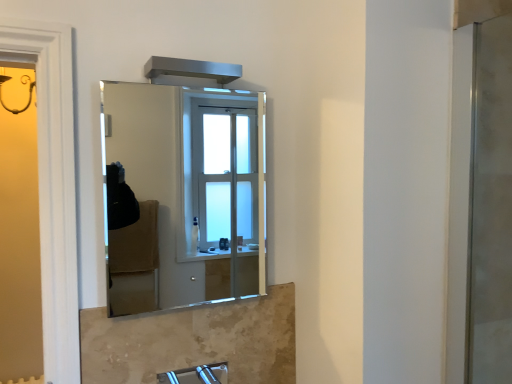
Question: In terms of width, does clear glass mirror at center look wider or thinner when compared to clear glass screen door at right?

Choices:
 (A) wide
 (B) thin

Answer: (B)

Question: Considering the positions of clear glass mirror at center and clear glass screen door at right in the image, is clear glass mirror at center taller or shorter than clear glass screen door at right?

Choices:
 (A) tall
 (B) short

Answer: (B)

Question: Considering the real-world distances, which object is farthest from the satin nickel faucet at lower center?

Choices:
 (A) clear glass mirror at center
 (B) clear glass screen door at right

Answer: (A)

Question: Estimate the real-world distances between objects in this image. Which object is farther from the clear glass mirror at center?

Choices:
 (A) satin nickel faucet at lower center
 (B) clear glass screen door at right

Answer: (B)